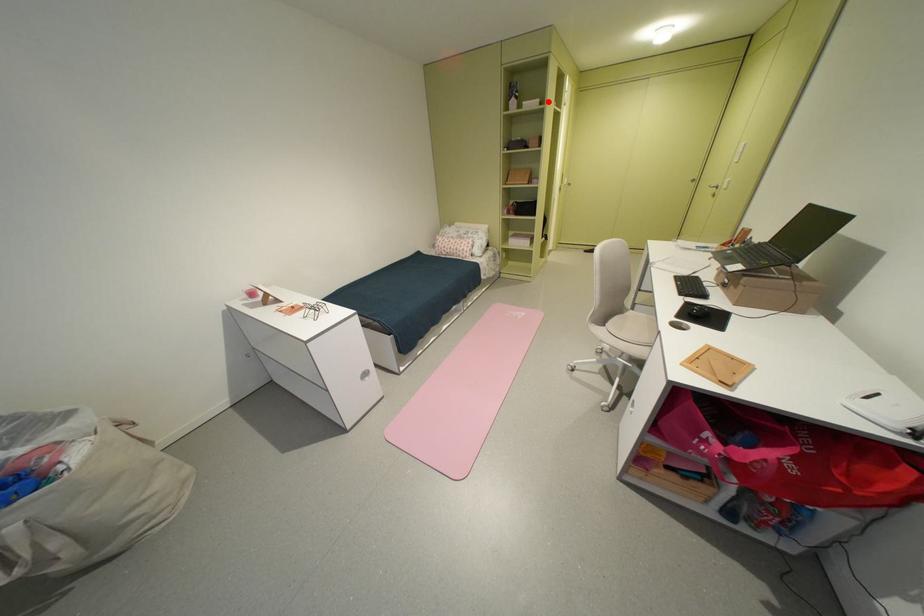
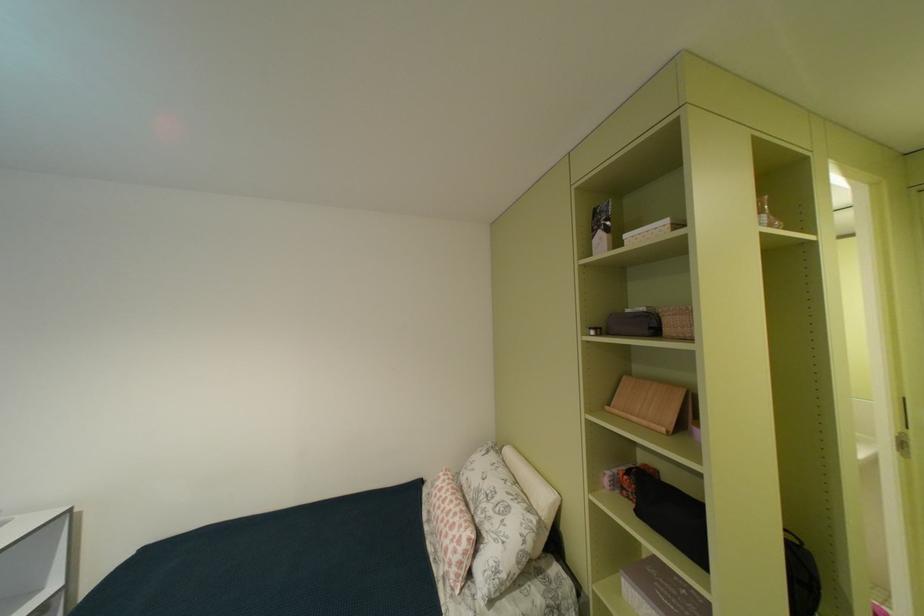
Question: I am providing you with two images of the same scene from different viewpoints. A red point is shown in image1. For the corresponding object point in image2, is it positioned nearer or farther from the camera?

Choices:
 (A) Nearer
 (B) Farther

Answer: (B)